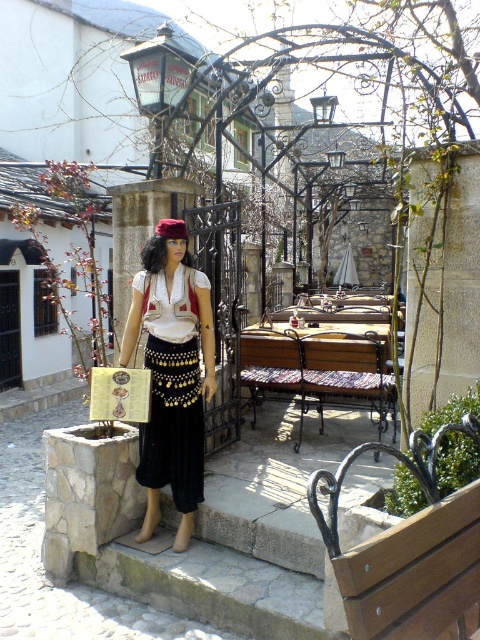
You are planning to place a velvet red hat at center on top of the wooden bench at center. Based on their sizes, will the hat fit comfortably without falling off?

The wooden bench at center is larger in size than the velvet red hat at center, so the hat will fit comfortably and is less likely to fall off when placed on top.

You are a tailor measuring the distance between the matte black skirt at center and the velvet red hat at center for a costume display. The minimum required distance for proper display is 30 inches. Can the current placement meet the requirement?

The matte black skirt at center is 31.04 inches from the velvet red hat at center, which exceeds the minimum required distance of 30 inches. Therefore, the current placement meets the requirement.

You are a visitor to this historical area and want to take a photo of the matte black skirt at center and the wooden bench at center. Which object should you focus on first if you want to capture both in the same frame without moving your camera?

The matte black skirt at center is much taller than the wooden bench at center, so you should focus on the matte black skirt at center first to ensure it is fully in frame.